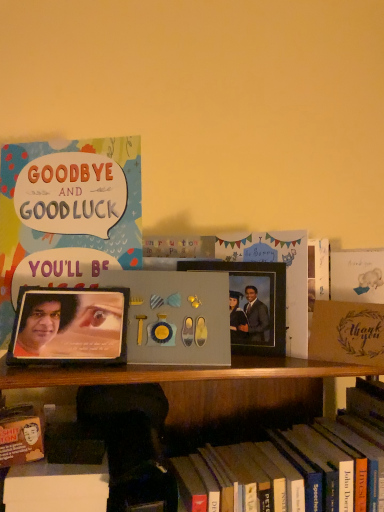
Question: Is hardcover book at lower center, positioned as the 1th book in bottom-to-top order, in front of or behind metallic photo frame at center, which is the second picture frame from left to right, in the image?

Choices:
 (A) behind
 (B) front

Answer: (B)

Question: Is hardcover book at lower center, which is the 2th book in top-to-bottom order, inside the boundaries of metallic photo frame at center, which is the 1th picture frame in right-to-left order, or outside?

Choices:
 (A) inside
 (B) outside

Answer: (B)

Question: Estimate the real-world distances between objects in this image. Which object is farther from the metallic photo frame at center, which is the 1th picture frame in right-to-left order?

Choices:
 (A) matte black picture frame at left, positioned as the 1th picture frame in left-to-right order
 (B) matte cardstock card at upper left, which is the 1th book in left-to-right order
 (C) hardcover book at lower center, which is the 1th book in right-to-left order
 (D) brown textured paper at right

Answer: (B)

Question: Which object is positioned closest to the matte black picture frame at left, which appears as the 2th picture frame when viewed from the back?

Choices:
 (A) matte cardstock card at upper left, arranged as the second book when ordered from the bottom
 (B) hardcover book at lower center, acting as the 2th book starting from the left
 (C) metallic photo frame at center, the second picture frame from the front
 (D) brown textured paper at right

Answer: (A)